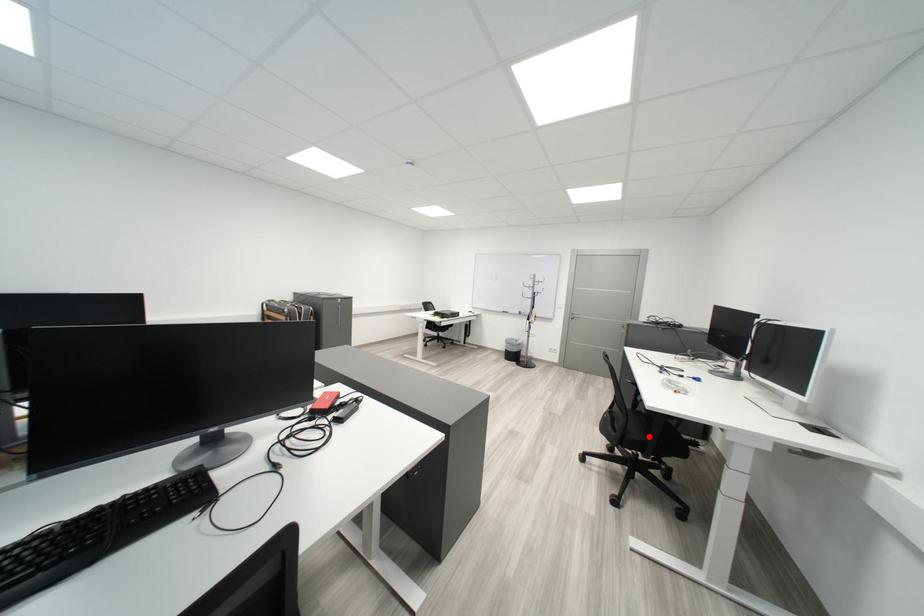
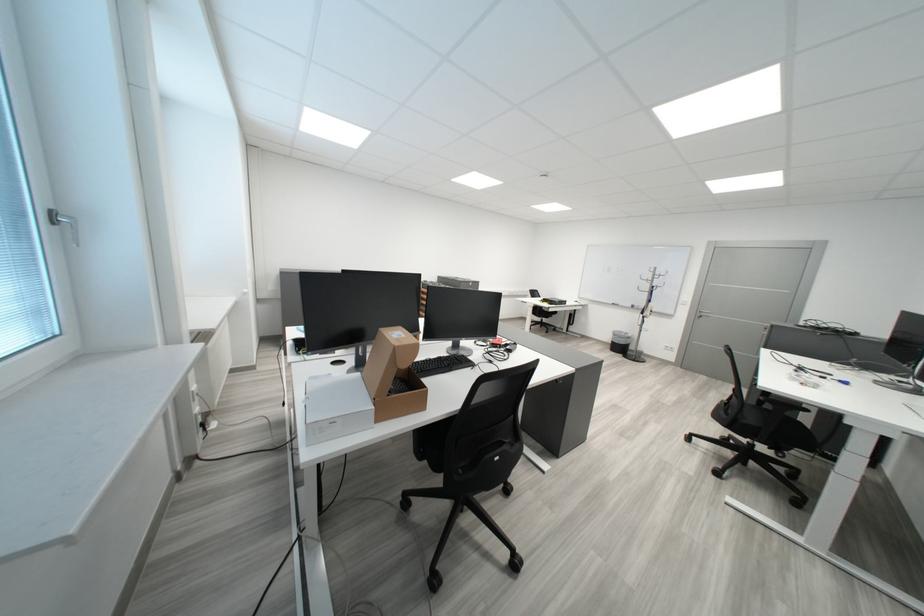
Where in the second image is the point corresponding to the highlighted location from the first image?

(763, 422)